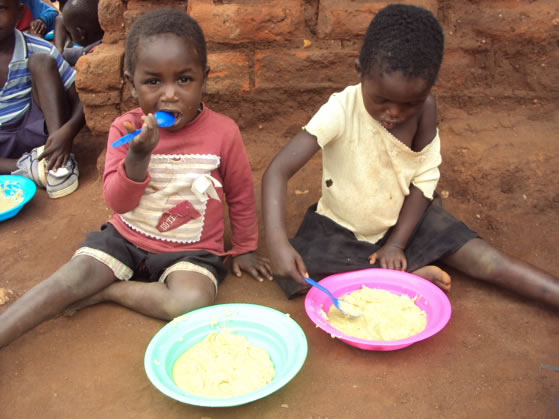
Image resolution: width=559 pixels, height=419 pixels. What are the coordinates of `floor` in the screenshot? It's located at (336, 393).